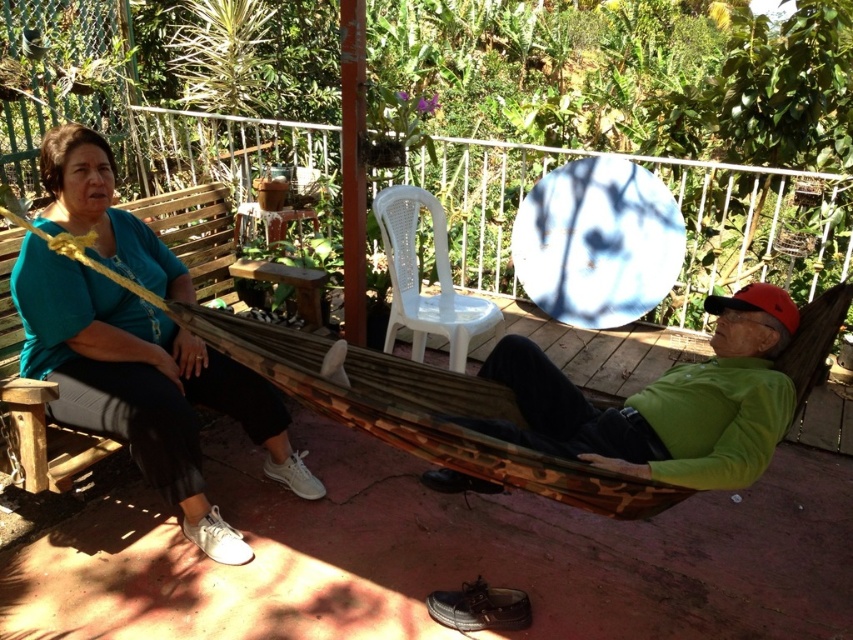
In the scene shown: You are standing at the center of the scene and want to hand a drink to the person wearing the green matte shirt at right. Which direction should you move to reach them?

The green matte shirt at right is located at point 0.630 on the x and 0.781 on the y, so you should move to the right and slightly forward to reach them.

Based on the scene description, if you were standing where the camera is positioned, which object would be closer to you between the white plastic chair at center and the wooden bench at left?

The white plastic chair at center is closer to you because it is positioned to the right of the wooden bench at left, indicating it is nearer in the visual plane from the camera perspective.

You are planning to set up a small picnic area and want to place a blanket between the white plastic chair at center and the wooden bench at left. Based on their widths, which object should you place closer to the edge of the picnic area to ensure the blanket fits comfortably?

Since the white plastic chair at center might be wider than the wooden bench at left, you should place the wider white plastic chair at center closer to the edge to accommodate the blanket between them.